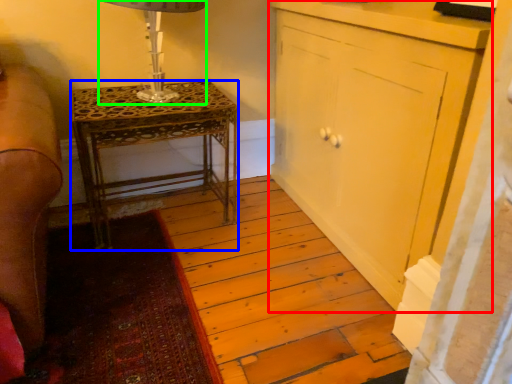
Question: Which object is positioned closest to cabinetry (highlighted by a red box)? Select from nightstand (highlighted by a blue box) and table lamp (highlighted by a green box).

Choices:
 (A) nightstand
 (B) table lamp

Answer: (A)